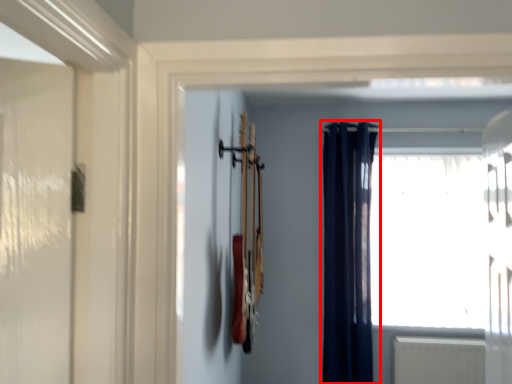
Question: From the image's perspective, what is the correct spatial relationship of curtain (annotated by the red box) in relation to window?

Choices:
 (A) below
 (B) above

Answer: (A)